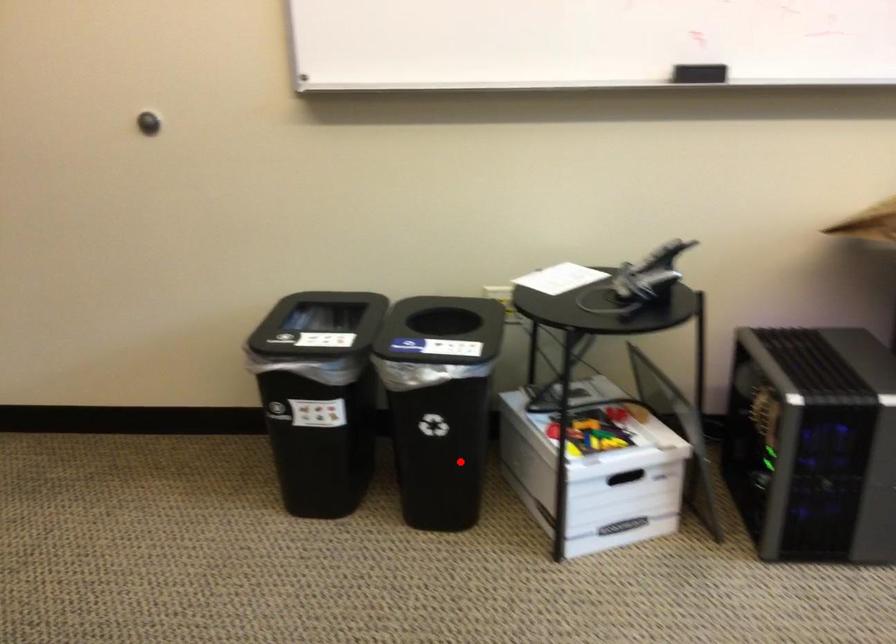
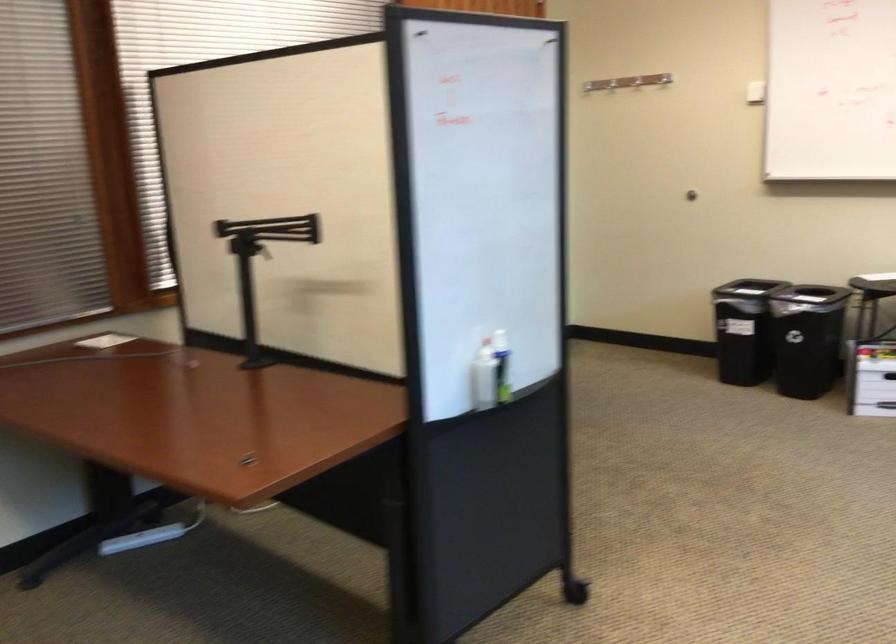
Question: A red point is marked in image1. In image2, is the corresponding 3D point closer to the camera or farther? Reply with the corresponding letter.

Choices:
 (A) The corresponding 3D point is closer.
 (B) The corresponding 3D point is farther.

Answer: (B)